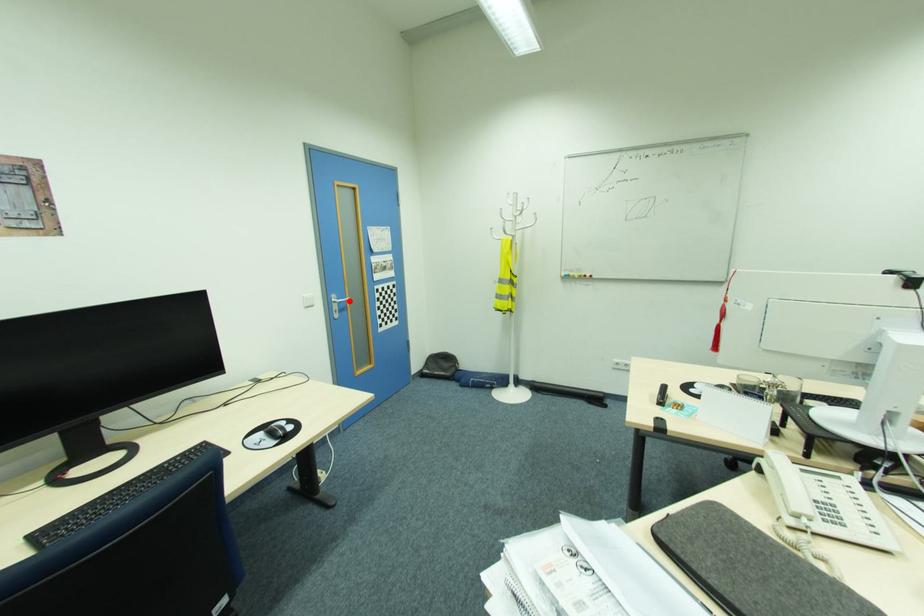
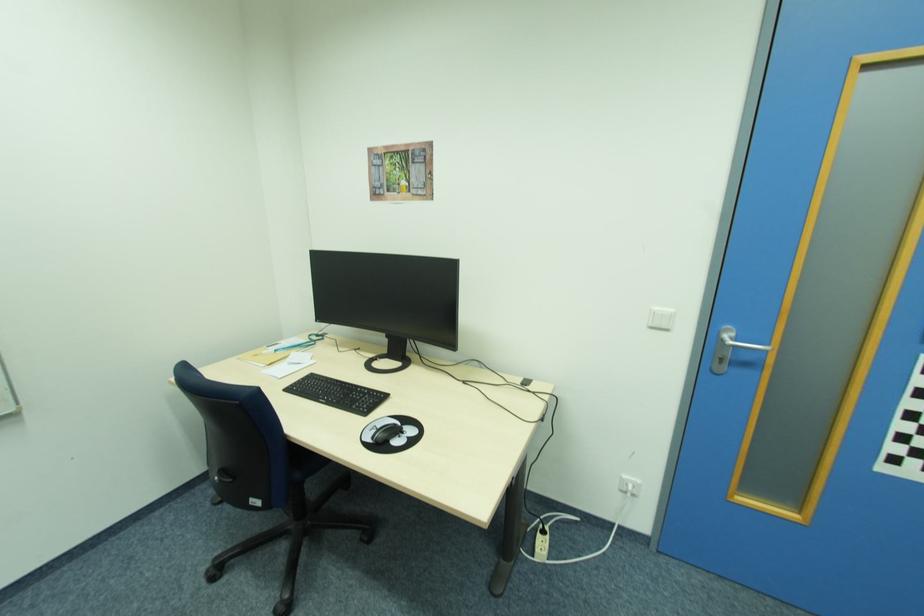
The point at the highlighted location is marked in the first image. Where is the corresponding point in the second image?

(768, 350)